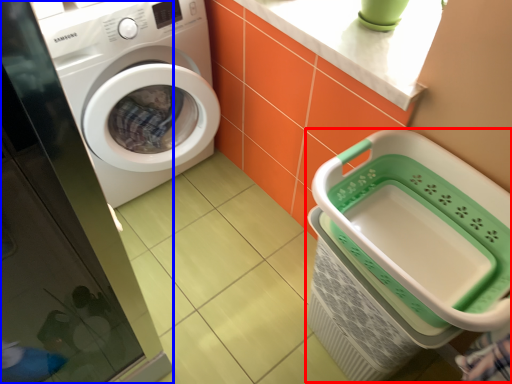
Question: Which object appears closest to the camera in this image, shopping basket (highlighted by a red box) or screen door (highlighted by a blue box)?

Choices:
 (A) shopping basket
 (B) screen door

Answer: (B)